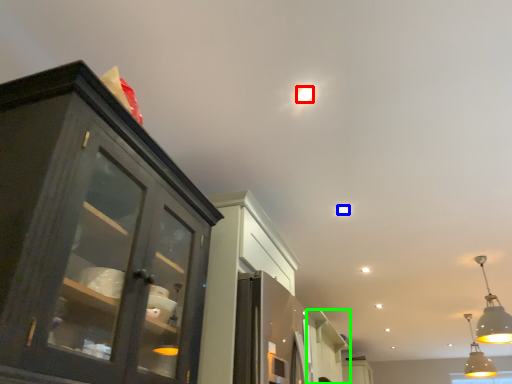
Question: Considering the real-world distances, which object is closest to droplight (highlighted by a red box)? light (highlighted by a blue box) or cabinetry (highlighted by a green box).

Choices:
 (A) light
 (B) cabinetry

Answer: (A)